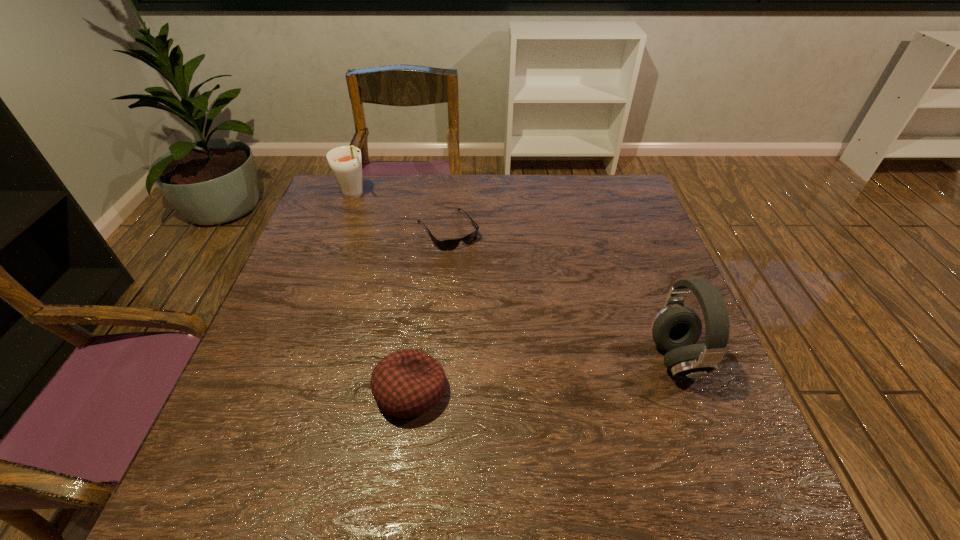
This screenshot has width=960, height=540. What are the coordinates of `the second shortest object` in the screenshot? It's located at (407, 383).

In order to click on headset in this screenshot , I will do `click(675, 329)`.

Image resolution: width=960 pixels, height=540 pixels. What are the coordinates of `the shortest object` in the screenshot? It's located at (445, 245).

You are a GUI agent. You are given a task and a screenshot of the screen. Output one action in this format:
    pyautogui.click(x=<x>, y=<y>)
    Task: Click on the sunglasses
    The width and height of the screenshot is (960, 540).
    Given the screenshot: What is the action you would take?
    pyautogui.click(x=445, y=245)

You are a GUI agent. You are given a task and a screenshot of the screen. Output one action in this format:
    pyautogui.click(x=<x>, y=<y>)
    Task: Click on the root beer
    This screenshot has height=540, width=960.
    Given the screenshot: What is the action you would take?
    pyautogui.click(x=345, y=162)

The width and height of the screenshot is (960, 540). Identify the location of the leftmost object. (345, 162).

Where is `vacant point located 0.350m on the back of the beanbag`? vacant point located 0.350m on the back of the beanbag is located at coordinates (428, 253).

Where is `free space located 0.310m on the front-facing side of the sunglasses`? Image resolution: width=960 pixels, height=540 pixels. free space located 0.310m on the front-facing side of the sunglasses is located at coordinates (519, 329).

Where is `free spot located on the front-facing side of the sunglasses`? free spot located on the front-facing side of the sunglasses is located at coordinates (468, 260).

The width and height of the screenshot is (960, 540). Find the location of `vacant space located 0.120m on the front-facing side of the sunglasses`. vacant space located 0.120m on the front-facing side of the sunglasses is located at coordinates (481, 277).